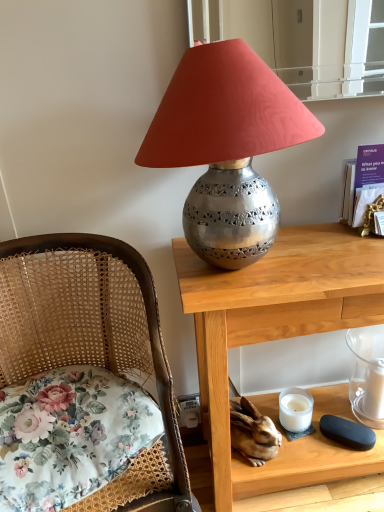
Question: From the image's perspective, is white matte candle at lower right above or below transparent glass candle at lower right, acting as the first candle holder starting from the right?

Choices:
 (A) above
 (B) below

Answer: (B)

Question: Relative to transparent glass candle at lower right, which is counted as the 2th candle holder, starting from the left, is white matte candle at lower right in front or behind?

Choices:
 (A) front
 (B) behind

Answer: (B)

Question: Estimate the real-world distances between objects in this image. Which object is closer to the metallic silver lampshade at upper center?

Choices:
 (A) purple paper at upper right
 (B) white matte candle at lower right
 (C) transparent glass candle at lower right, acting as the first candle holder starting from the right
 (D) floral fabric cushion at left
 (E) polished wood desk at center

Answer: (E)

Question: Which of these objects is positioned closest to the polished wood desk at center?

Choices:
 (A) floral fabric cushion at left
 (B) woven cane chair at left
 (C) white matte candle at lower right, which is counted as the 2th candle holder, starting from the right
 (D) purple paper at upper right
 (E) metallic silver lampshade at upper center

Answer: (E)